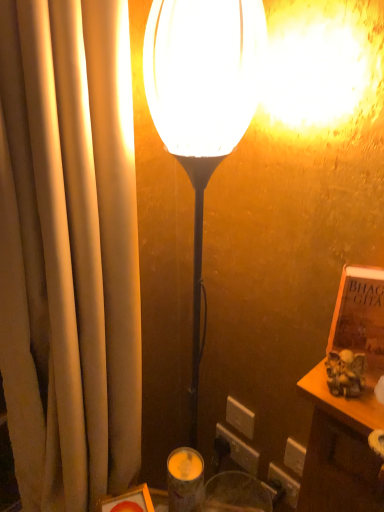
Question: Should I look upward or downward to see white plastic electric outlet at lower center, which is counted as the 2th electric outlet, starting from the top?

Choices:
 (A) down
 (B) up

Answer: (A)

Question: Are brown leather book at right and beige fabric curtain at left making contact?

Choices:
 (A) yes
 (B) no

Answer: (B)

Question: Is brown leather book at right positioned in front of beige fabric curtain at left?

Choices:
 (A) yes
 (B) no

Answer: (B)

Question: Could you tell me if brown leather book at right is turned towards beige fabric curtain at left?

Choices:
 (A) no
 (B) yes

Answer: (A)

Question: From a real-world perspective, is brown leather book at right positioned under beige fabric curtain at left based on gravity?

Choices:
 (A) no
 (B) yes

Answer: (A)

Question: Is brown leather book at right far away from beige fabric curtain at left?

Choices:
 (A) yes
 (B) no

Answer: (B)

Question: Is beige fabric curtain at left completely or partially inside brown leather book at right?

Choices:
 (A) no
 (B) yes

Answer: (A)

Question: Can you confirm if white plastic electric outlet at lower center, placed as the 2th electric outlet when sorted from bottom to top, is taller than beige fabric curtain at left?

Choices:
 (A) no
 (B) yes

Answer: (A)

Question: Is white plastic electric outlet at lower center, the first electric outlet in the top-to-bottom sequence, at the left side of beige fabric curtain at left?

Choices:
 (A) yes
 (B) no

Answer: (B)

Question: Is beige fabric curtain at left a part of white plastic electric outlet at lower center, placed as the 2th electric outlet when sorted from bottom to top?

Choices:
 (A) yes
 (B) no

Answer: (B)

Question: Does white plastic electric outlet at lower center, placed as the 2th electric outlet when sorted from bottom to top, have a lesser height compared to beige fabric curtain at left?

Choices:
 (A) yes
 (B) no

Answer: (A)

Question: From the image's perspective, is white plastic electric outlet at lower center, placed as the 2th electric outlet when sorted from bottom to top, located beneath beige fabric curtain at left?

Choices:
 (A) no
 (B) yes

Answer: (B)

Question: Considering the relative positions of white plastic electric outlet at lower center, the first electric outlet in the top-to-bottom sequence, and beige fabric curtain at left in the image provided, is white plastic electric outlet at lower center, the first electric outlet in the top-to-bottom sequence, in front of beige fabric curtain at left?

Choices:
 (A) yes
 (B) no

Answer: (B)

Question: From the image's perspective, is brown leather book at right on top of matte glass candle holder at lower center?

Choices:
 (A) no
 (B) yes

Answer: (B)